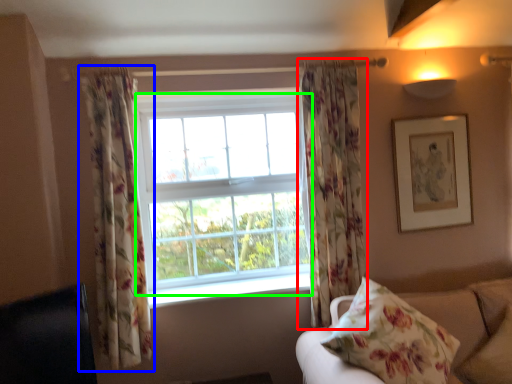
Question: Which object is the farthest from curtain (highlighted by a red box)? Choose among these: curtain (highlighted by a blue box) or bay window (highlighted by a green box).

Choices:
 (A) curtain
 (B) bay window

Answer: (A)